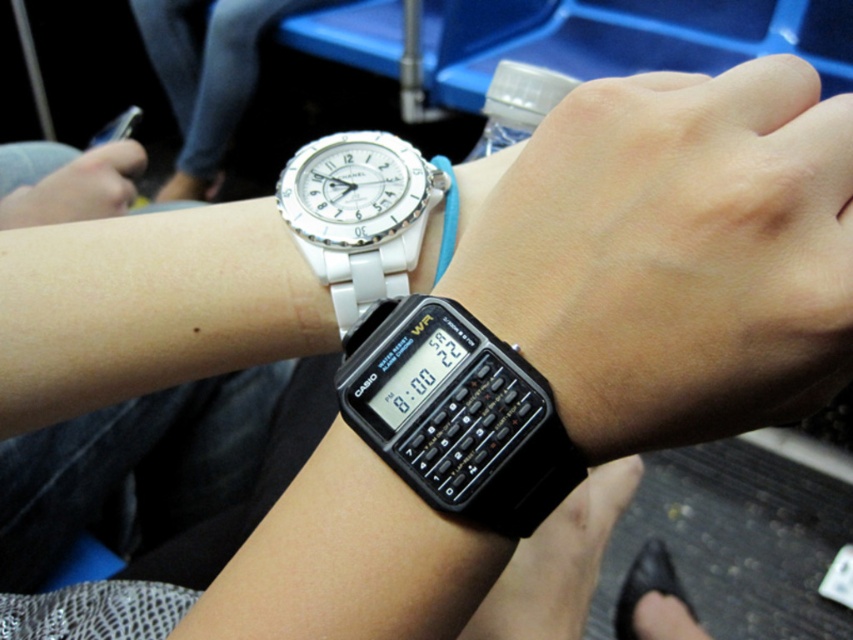
Question: Which object appears farthest from the camera in this image?

Choices:
 (A) blue fabric strap at center
 (B) white ceramic watch at upper left
 (C) black plastic calculator at lower center
 (D) black rubber watch at lower center

Answer: (B)

Question: Which point is farther from the camera taking this photo?

Choices:
 (A) pos(383,173)
 (B) pos(560,442)
 (C) pos(740,387)

Answer: (A)

Question: Which point appears farthest from the camera in this image?

Choices:
 (A) (637, 387)
 (B) (343, 268)
 (C) (451, 205)

Answer: (C)

Question: Is black plastic calculator at lower center positioned before blue fabric strap at center?

Choices:
 (A) yes
 (B) no

Answer: (A)

Question: Does black rubber watch at lower center come behind blue fabric strap at center?

Choices:
 (A) no
 (B) yes

Answer: (A)

Question: Does black rubber watch at lower center appear over white ceramic watch at upper left?

Choices:
 (A) no
 (B) yes

Answer: (B)